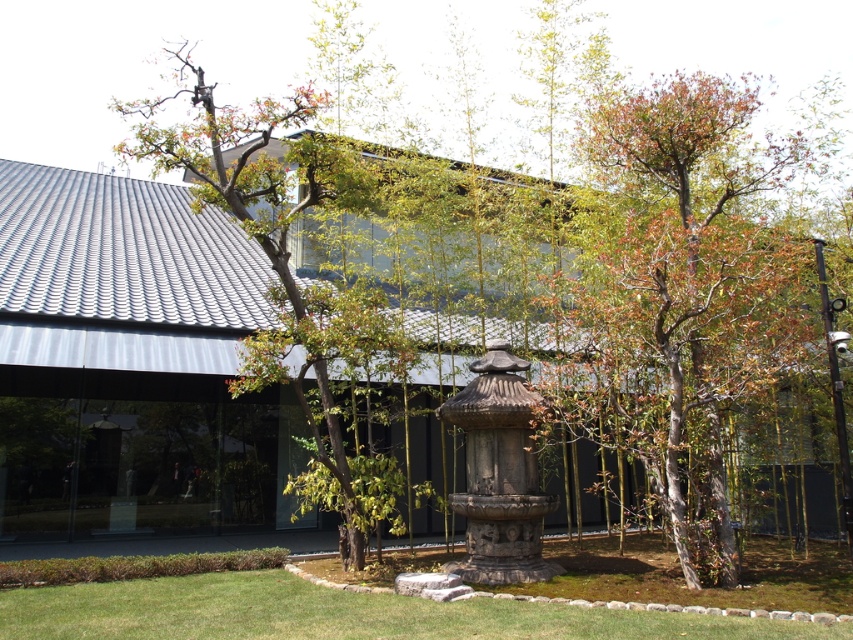
You are standing at the entrance of the building and want to place a new decorative item at the point marked as point (x=677, y=296). Which object in the garden is located at that coordinate?

The point (x=677, y=296) is on the smooth gray stone statue at center.

You are a gardener who needs to water the green grass at lower center. The watering can you have can only reach 5 feet. Is the smooth gray stone statue at center in the way of watering the grass?

The smooth gray stone statue at center is 6.13 feet away from the green grass at lower center. Since the watering can can only reach 5 feet, the statue is not in the way and the grass can be watered from a distance.